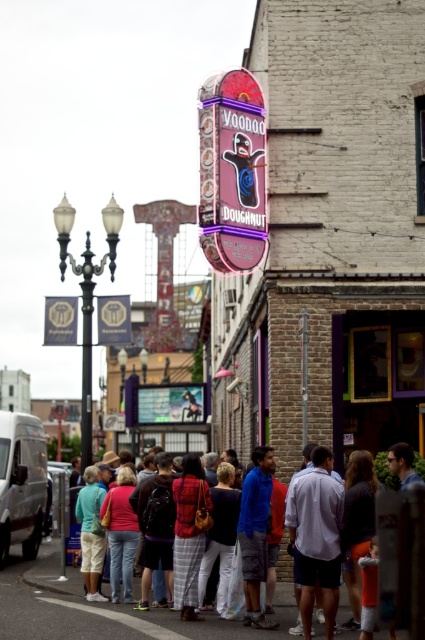
Based on the photo, you are a delivery person trying to park your bike. The gold metallic sign at left and the white asphalt at lower center are in your view. Which area should you avoid parking your bike to ensure it doesn not block the sign?

You should avoid parking your bike near the gold metallic sign at left because it is bigger and might require more space to not block it.

You are a photographer trying to capture both the plaid fabric shirt at center and the gold metallic sign at center in one frame. Based on their widths, will you need to adjust your camera angle to include both?

The plaid fabric shirt at center might be wider than gold metallic sign at center, so adjusting the camera angle might be necessary to ensure both fit within the frame.